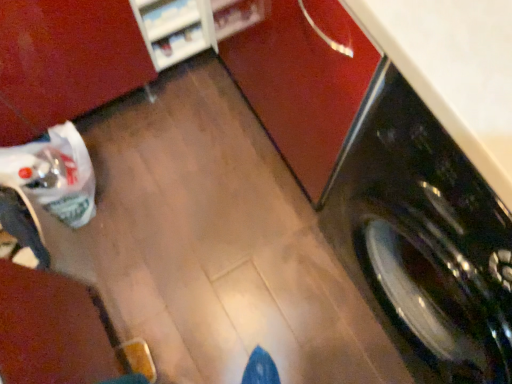
I want to click on black glossy washing machine at right, so point(423,239).

What do you see at coordinates (423, 239) in the screenshot? Image resolution: width=512 pixels, height=384 pixels. I see `black glossy washing machine at right` at bounding box center [423, 239].

The height and width of the screenshot is (384, 512). What do you see at coordinates (175, 29) in the screenshot?
I see `white glossy shelf at upper left` at bounding box center [175, 29].

Image resolution: width=512 pixels, height=384 pixels. I want to click on white glossy shelf at upper left, so click(x=175, y=29).

Locate an element on the screen. This screenshot has width=512, height=384. black glossy washing machine at right is located at coordinates (423, 239).

Between black glossy washing machine at right and white glossy shelf at upper left, which one appears on the right side from the viewer's perspective?

Positioned to the right is black glossy washing machine at right.

From the picture: Is black glossy washing machine at right further to the viewer compared to white glossy shelf at upper left?

No, it is not.

Which is farther, (508,349) or (187,0)?

Positioned behind is point (187,0).

From the image's perspective, which one is positioned higher, black glossy washing machine at right or white glossy shelf at upper left?

From the image's view, white glossy shelf at upper left is above.

From a real-world perspective, between black glossy washing machine at right and white glossy shelf at upper left, who is vertically lower?

From a 3D spatial view, white glossy shelf at upper left is below.

Can you confirm if black glossy washing machine at right is thinner than white glossy shelf at upper left?

No.

From their relative heights in the image, would you say black glossy washing machine at right is taller or shorter than white glossy shelf at upper left?

Considering their sizes, black glossy washing machine at right has more height than white glossy shelf at upper left.

Considering the relative sizes of black glossy washing machine at right and white glossy shelf at upper left in the image provided, is black glossy washing machine at right bigger than white glossy shelf at upper left?

Yes.

Is white glossy shelf at upper left a part of black glossy washing machine at right?

No, white glossy shelf at upper left is not inside black glossy washing machine at right.

Is black glossy washing machine at right next to white glossy shelf at upper left and touching it?

black glossy washing machine at right and white glossy shelf at upper left are not in contact.

Is black glossy washing machine at right oriented away from white glossy shelf at upper left?

No, white glossy shelf at upper left is not at the back of black glossy washing machine at right.

How many degrees apart are the facing directions of black glossy washing machine at right and white glossy shelf at upper left?

The facing directions of black glossy washing machine at right and white glossy shelf at upper left are 90.5 degrees apart.

Measure the distance from black glossy washing machine at right to white glossy shelf at upper left.

They are 77.32 centimeters apart.

The width and height of the screenshot is (512, 384). Identify the location of washing machine on the right side of white glossy shelf at upper left. (423, 239).

Can you confirm if white glossy shelf at upper left is positioned to the left of black glossy washing machine at right?

Correct, you'll find white glossy shelf at upper left to the left of black glossy washing machine at right.

Relative to black glossy washing machine at right, is white glossy shelf at upper left in front or behind?

Visually, white glossy shelf at upper left is located behind black glossy washing machine at right.

Is point (196, 14) behind point (432, 230)?

Yes.

From the image's perspective, is white glossy shelf at upper left above black glossy washing machine at right?

Yes, from the image's perspective, white glossy shelf at upper left is over black glossy washing machine at right.

From a real-world perspective, is white glossy shelf at upper left positioned under black glossy washing machine at right based on gravity?

Yes, from a real-world perspective, white glossy shelf at upper left is below black glossy washing machine at right.

Does white glossy shelf at upper left have a lesser width compared to black glossy washing machine at right?

Yes, white glossy shelf at upper left is thinner than black glossy washing machine at right.

Is white glossy shelf at upper left taller or shorter than black glossy washing machine at right?

white glossy shelf at upper left is shorter than black glossy washing machine at right.

Can you confirm if white glossy shelf at upper left is smaller than black glossy washing machine at right?

Yes.

Is white glossy shelf at upper left not inside black glossy washing machine at right?

Yes, white glossy shelf at upper left is outside of black glossy washing machine at right.

Would you say white glossy shelf at upper left is a long distance from black glossy washing machine at right?

Actually, white glossy shelf at upper left and black glossy washing machine at right are a little close together.

Is white glossy shelf at upper left aimed at black glossy washing machine at right?

Yes, white glossy shelf at upper left is oriented towards black glossy washing machine at right.

I want to click on shelf lying on the left of black glossy washing machine at right, so click(175, 29).

Identify the location of washing machine positioned vertically above the white glossy shelf at upper left (from a real-world perspective). The width and height of the screenshot is (512, 384). (423, 239).

Where is `shelf on the left of black glossy washing machine at right`? The image size is (512, 384). shelf on the left of black glossy washing machine at right is located at coordinates (175, 29).